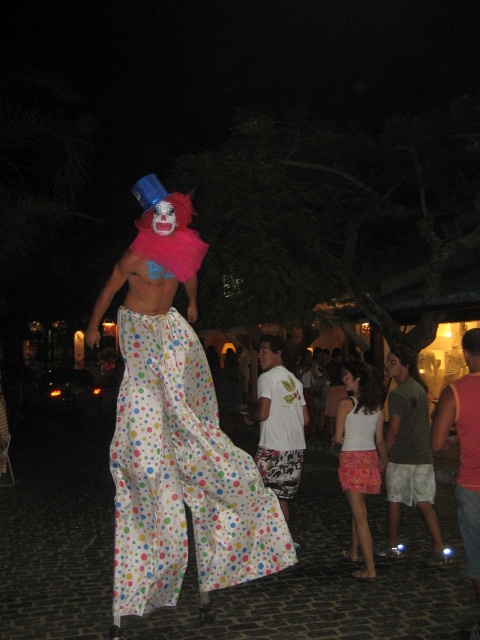
You are a photographer positioned at the center of the scene. You want to capture a closeup shot of the white polka dot pants at center. Which direction should you aim your camera to ensure the pants are in the frame?

The white polka dot pants at center are already at the center of the scene, so you should aim your camera directly forward to capture them in the frame.

You are a photographer at the event and want to focus your camera on the white tank top at center and the pink fabric skirt at lower center. Which one should you adjust the focus for first if you want to capture both clearly in the same photo?

The white tank top at center should be focused on first because it is closer to the viewer than the pink fabric skirt at lower center, allowing for better depth of field when capturing both.

Consider the image. You are at the point labeled point (271, 378) and want to move towards the clown performer. Is the point labeled point (357, 545) between you and the clown performer?

Yes, point (357, 545) is between you and the clown performer because it is in front of point (271, 378) where you are standing.